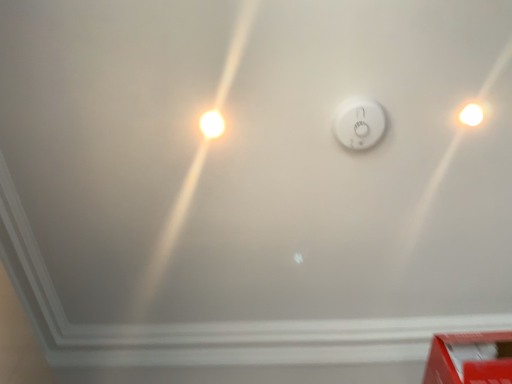
Measure the distance between point (209, 125) and camera.

4.03 feet.

This screenshot has width=512, height=384. Find the location of `white glossy light bulb at upper right, marked as the second light bulb in a left-to-right arrangement`. white glossy light bulb at upper right, marked as the second light bulb in a left-to-right arrangement is located at coordinates (471, 115).

Locate an element on the screen. The width and height of the screenshot is (512, 384). red cardboard box at lower right is located at coordinates (469, 359).

Image resolution: width=512 pixels, height=384 pixels. I want to click on white glossy light bulb at upper left, placed as the second light bulb when sorted from right to left, so (212, 124).

Is red cardboard box at lower right closer to the viewer compared to white glossy light bulb at upper right, the 1th light bulb in the right-to-left sequence?

That is True.

From the picture: Which of these two, red cardboard box at lower right or white glossy light bulb at upper right, the 1th light bulb in the right-to-left sequence, stands taller?

red cardboard box at lower right.

Consider the image. Is red cardboard box at lower right oriented away from white glossy light bulb at upper right, the 1th light bulb in the right-to-left sequence?

red cardboard box at lower right does not have its back to white glossy light bulb at upper right, the 1th light bulb in the right-to-left sequence.

Does point (472, 116) lie behind point (209, 137)?

No, it is not.

Does white glossy light bulb at upper right, the 1th light bulb in the right-to-left sequence, appear on the left side of white glossy light bulb at upper left, placed as the second light bulb when sorted from right to left?

In fact, white glossy light bulb at upper right, the 1th light bulb in the right-to-left sequence, is to the right of white glossy light bulb at upper left, placed as the second light bulb when sorted from right to left.

Looking at their sizes, would you say white glossy light bulb at upper right, marked as the second light bulb in a left-to-right arrangement, is wider or thinner than white glossy light bulb at upper left, placed as the second light bulb when sorted from right to left?

white glossy light bulb at upper right, marked as the second light bulb in a left-to-right arrangement, is wider than white glossy light bulb at upper left, placed as the second light bulb when sorted from right to left.

From a real-world perspective, who is located lower, white plastic smoke detector at center or red cardboard box at lower right?

red cardboard box at lower right, from a real-world perspective.

Can you confirm if white plastic smoke detector at center is positioned to the left of red cardboard box at lower right?

Correct, you'll find white plastic smoke detector at center to the left of red cardboard box at lower right.

Based on the photo, would you say white plastic smoke detector at center is outside red cardboard box at lower right?

Yes.

Who is smaller, white plastic smoke detector at center or red cardboard box at lower right?

With smaller size is white plastic smoke detector at center.

Between red cardboard box at lower right and white plastic smoke detector at center, which one has larger size?

red cardboard box at lower right.

Based on the photo, which of these two, red cardboard box at lower right or white plastic smoke detector at center, stands taller?

With more height is red cardboard box at lower right.

Which object is thinner, red cardboard box at lower right or white plastic smoke detector at center?

white plastic smoke detector at center is thinner.

Which point is more forward, (449, 377) or (380, 119)?

The point (449, 377) is closer.

Who is shorter, white plastic smoke detector at center or white glossy light bulb at upper right, the 1th light bulb in the right-to-left sequence?

With less height is white glossy light bulb at upper right, the 1th light bulb in the right-to-left sequence.

Is white plastic smoke detector at center wider or thinner than white glossy light bulb at upper right, the 1th light bulb in the right-to-left sequence?

Clearly, white plastic smoke detector at center has more width compared to white glossy light bulb at upper right, the 1th light bulb in the right-to-left sequence.

From the image's perspective, is white plastic smoke detector at center positioned above or below white glossy light bulb at upper right, marked as the second light bulb in a left-to-right arrangement?

Based on their image positions, white plastic smoke detector at center is located beneath white glossy light bulb at upper right, marked as the second light bulb in a left-to-right arrangement.

Considering the positions of points (353, 116) and (459, 116), is point (353, 116) farther from camera compared to point (459, 116)?

That is False.

From a real-world perspective, between white glossy light bulb at upper left, the 1th light bulb from the left, and white plastic smoke detector at center, who is vertically lower?

white plastic smoke detector at center, from a real-world perspective.

Who is more distant, white glossy light bulb at upper left, placed as the second light bulb when sorted from right to left, or white plastic smoke detector at center?

white glossy light bulb at upper left, placed as the second light bulb when sorted from right to left, is behind.

Could you tell me if white glossy light bulb at upper left, placed as the second light bulb when sorted from right to left, is facing white plastic smoke detector at center?

Yes, white glossy light bulb at upper left, placed as the second light bulb when sorted from right to left, is oriented towards white plastic smoke detector at center.

Considering the relative sizes of white glossy light bulb at upper left, the 1th light bulb from the left, and white glossy light bulb at upper right, the 1th light bulb in the right-to-left sequence, in the image provided, is white glossy light bulb at upper left, the 1th light bulb from the left, smaller than white glossy light bulb at upper right, the 1th light bulb in the right-to-left sequence,?

Yes, white glossy light bulb at upper left, the 1th light bulb from the left, is smaller than white glossy light bulb at upper right, the 1th light bulb in the right-to-left sequence.

How far apart are white glossy light bulb at upper left, the 1th light bulb from the left, and white glossy light bulb at upper right, the 1th light bulb in the right-to-left sequence?

white glossy light bulb at upper left, the 1th light bulb from the left, and white glossy light bulb at upper right, the 1th light bulb in the right-to-left sequence, are 27.75 inches apart.

Would you say white glossy light bulb at upper left, placed as the second light bulb when sorted from right to left, is to the left or to the right of white glossy light bulb at upper right, marked as the second light bulb in a left-to-right arrangement, in the picture?

Based on their positions, white glossy light bulb at upper left, placed as the second light bulb when sorted from right to left, is located to the left of white glossy light bulb at upper right, marked as the second light bulb in a left-to-right arrangement.

Is white glossy light bulb at upper left, the 1th light bulb from the left, facing away from white glossy light bulb at upper right, the 1th light bulb in the right-to-left sequence?

No, white glossy light bulb at upper left, the 1th light bulb from the left, is not facing the opposite direction of white glossy light bulb at upper right, the 1th light bulb in the right-to-left sequence.

Which light bulb is the 1st one when counting from the back of the red cardboard box at lower right? Please provide its 2D coordinates.

[(471, 115)]

This screenshot has height=384, width=512. Identify the location of light bulb below the white glossy light bulb at upper right, marked as the second light bulb in a left-to-right arrangement (from the image's perspective). (212, 124).

When comparing their distances from white plastic smoke detector at center, does white glossy light bulb at upper left, the 1th light bulb from the left, or red cardboard box at lower right seem closer?

white glossy light bulb at upper left, the 1th light bulb from the left, is positioned closer to the anchor white plastic smoke detector at center.

When comparing their distances from white glossy light bulb at upper left, placed as the second light bulb when sorted from right to left, does red cardboard box at lower right or white glossy light bulb at upper right, the 1th light bulb in the right-to-left sequence, seem closer?

Among the two, white glossy light bulb at upper right, the 1th light bulb in the right-to-left sequence, is located nearer to white glossy light bulb at upper left, placed as the second light bulb when sorted from right to left.

Considering their positions, is white glossy light bulb at upper left, the 1th light bulb from the left, positioned closer to white plastic smoke detector at center than white glossy light bulb at upper right, the 1th light bulb in the right-to-left sequence?

white glossy light bulb at upper right, the 1th light bulb in the right-to-left sequence.

Which object lies nearer to the anchor point red cardboard box at lower right, white glossy light bulb at upper right, marked as the second light bulb in a left-to-right arrangement, or white plastic smoke detector at center?

Among the two, white plastic smoke detector at center is located nearer to red cardboard box at lower right.

Looking at the image, which one is located further to red cardboard box at lower right, white plastic smoke detector at center or white glossy light bulb at upper left, placed as the second light bulb when sorted from right to left?

Based on the image, white glossy light bulb at upper left, placed as the second light bulb when sorted from right to left, appears to be further to red cardboard box at lower right.

Looking at the image, which one is located further to white glossy light bulb at upper right, marked as the second light bulb in a left-to-right arrangement, white glossy light bulb at upper left, the 1th light bulb from the left, or red cardboard box at lower right?

white glossy light bulb at upper left, the 1th light bulb from the left, is further to white glossy light bulb at upper right, marked as the second light bulb in a left-to-right arrangement.

Based on their spatial positions, is red cardboard box at lower right or white plastic smoke detector at center further from white glossy light bulb at upper left, placed as the second light bulb when sorted from right to left?

The object further to white glossy light bulb at upper left, placed as the second light bulb when sorted from right to left, is red cardboard box at lower right.

When comparing their distances from white glossy light bulb at upper left, placed as the second light bulb when sorted from right to left, does white plastic smoke detector at center or white glossy light bulb at upper right, marked as the second light bulb in a left-to-right arrangement, seem further?

Based on the image, white glossy light bulb at upper right, marked as the second light bulb in a left-to-right arrangement, appears to be further to white glossy light bulb at upper left, placed as the second light bulb when sorted from right to left.

In order to click on power plugs and sockets that lies between white glossy light bulb at upper left, placed as the second light bulb when sorted from right to left, and red cardboard box at lower right from top to bottom in this screenshot , I will do `click(359, 123)`.

I want to click on power plugs and sockets between white glossy light bulb at upper right, the 1th light bulb in the right-to-left sequence, and red cardboard box at lower right in the up-down direction, so (359, 123).

Where is `power plugs and sockets located between white glossy light bulb at upper left, the 1th light bulb from the left, and white glossy light bulb at upper right, the 1th light bulb in the right-to-left sequence, in the left-right direction`? This screenshot has height=384, width=512. power plugs and sockets located between white glossy light bulb at upper left, the 1th light bulb from the left, and white glossy light bulb at upper right, the 1th light bulb in the right-to-left sequence, in the left-right direction is located at coordinates (359, 123).

Image resolution: width=512 pixels, height=384 pixels. Identify the location of light bulb between white glossy light bulb at upper left, the 1th light bulb from the left, and red cardboard box at lower right, in the horizontal direction. (471, 115).